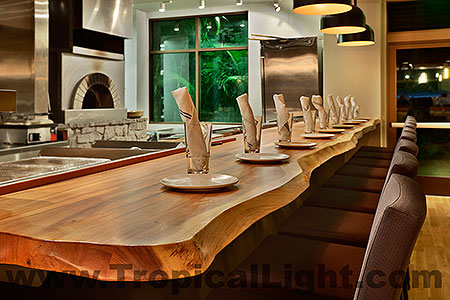
Where is `cups`? Image resolution: width=450 pixels, height=300 pixels. cups is located at coordinates [208, 150], [249, 135], [283, 130], [309, 123].